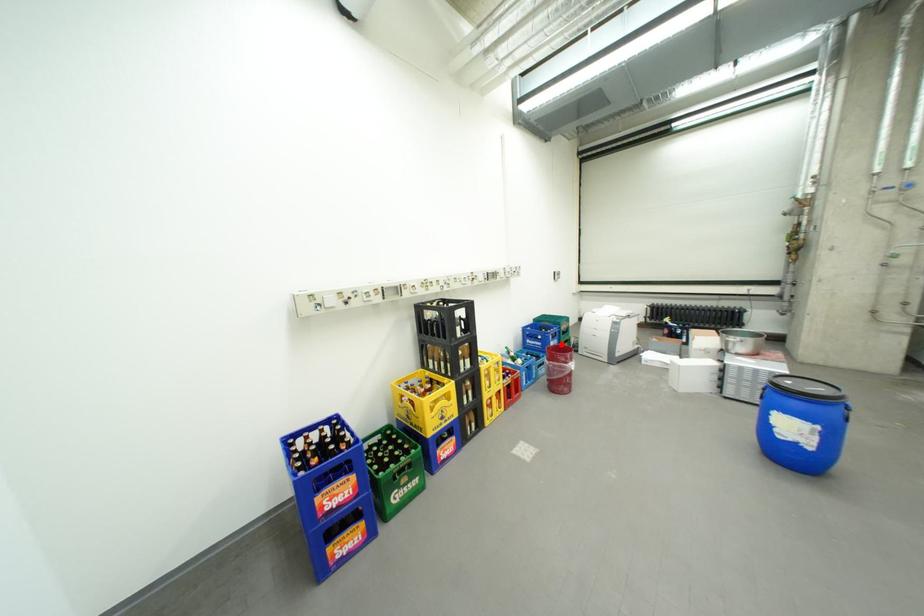
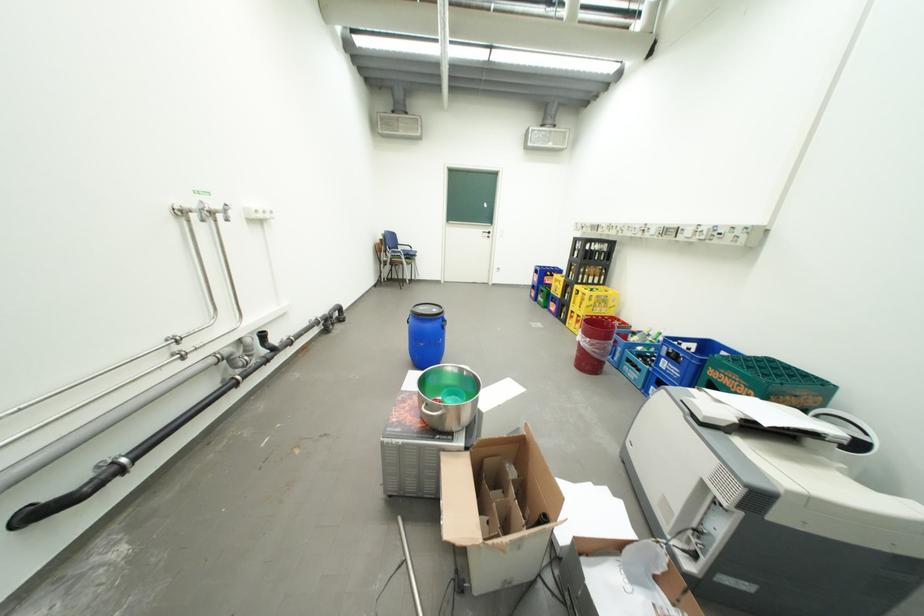
Question: I am providing you with two images of the same scene from different viewpoints. In image1, a red point is highlighted. Considering the same 3D point in image2, which of the following is correct?

Choices:
 (A) It is closer
 (B) It is farther

Answer: (A)